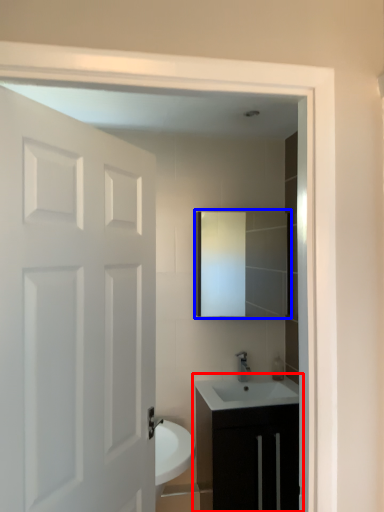
Question: Which object appears closest to the camera in this image, bathroom cabinet (highlighted by a red box) or mirror (highlighted by a blue box)?

Choices:
 (A) bathroom cabinet
 (B) mirror

Answer: (A)